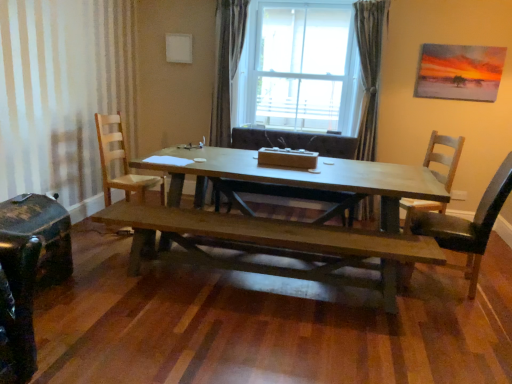
Question: Is shiny black suitcase at lower left shorter than wooden chair at right, which is counted as the third chair, starting from the left?

Choices:
 (A) yes
 (B) no

Answer: (A)

Question: Does shiny black suitcase at lower left appear on the left side of wooden chair at right, which is counted as the third chair, starting from the left?

Choices:
 (A) no
 (B) yes

Answer: (B)

Question: From the image's perspective, is shiny black suitcase at lower left located above wooden chair at right, the 2th chair when ordered from right to left?

Choices:
 (A) yes
 (B) no

Answer: (B)

Question: Does shiny black suitcase at lower left turn towards wooden chair at right, the 2th chair when ordered from right to left?

Choices:
 (A) no
 (B) yes

Answer: (A)

Question: Is shiny black suitcase at lower left in front of wooden chair at right, the 2th chair when ordered from right to left?

Choices:
 (A) yes
 (B) no

Answer: (A)

Question: Is wooden chair at right, the 2th chair when ordered from right to left, inside shiny black suitcase at lower left?

Choices:
 (A) no
 (B) yes

Answer: (A)

Question: Does transparent glass window at center come behind light brown wooden chair at left, marked as the fourth chair in a right-to-left arrangement?

Choices:
 (A) no
 (B) yes

Answer: (B)

Question: Could light brown wooden chair at left, acting as the 1th chair starting from the left, be considered to be inside transparent glass window at center?

Choices:
 (A) no
 (B) yes

Answer: (A)

Question: Is transparent glass window at center facing towards light brown wooden chair at left, marked as the fourth chair in a right-to-left arrangement?

Choices:
 (A) yes
 (B) no

Answer: (B)

Question: From the image's perspective, is transparent glass window at center over light brown wooden chair at left, marked as the fourth chair in a right-to-left arrangement?

Choices:
 (A) no
 (B) yes

Answer: (B)

Question: Is transparent glass window at center taller than light brown wooden chair at left, acting as the 1th chair starting from the left?

Choices:
 (A) no
 (B) yes

Answer: (B)

Question: Is transparent glass window at center wider than light brown wooden chair at left, marked as the fourth chair in a right-to-left arrangement?

Choices:
 (A) no
 (B) yes

Answer: (B)

Question: Would you say wooden chair at right, the 2th chair when ordered from right to left, is outside satin fabric curtain at center, which is the first curtain in left-to-right order?

Choices:
 (A) yes
 (B) no

Answer: (A)